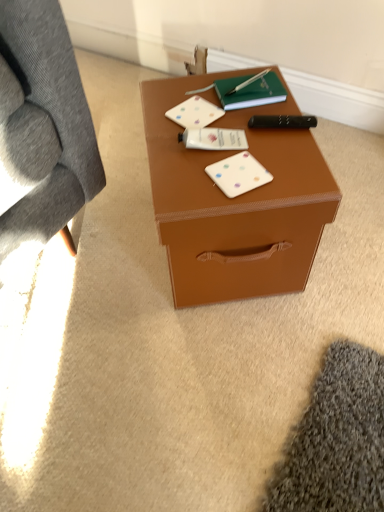
Locate an element on the screen. vacant space situated on the left part of brown matte box at center is located at coordinates (97, 269).